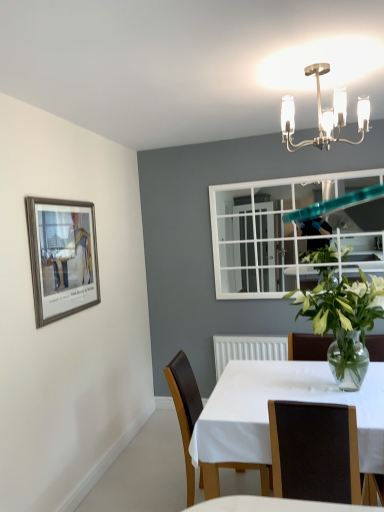
Image resolution: width=384 pixels, height=512 pixels. I want to click on vacant point above polished brass chandelier at upper center (from a real-world perspective), so click(337, 60).